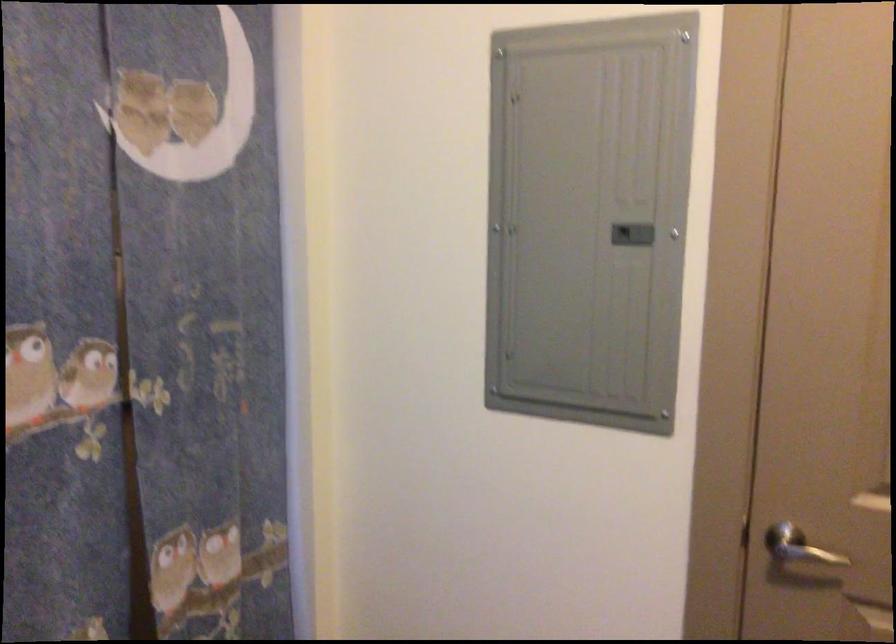
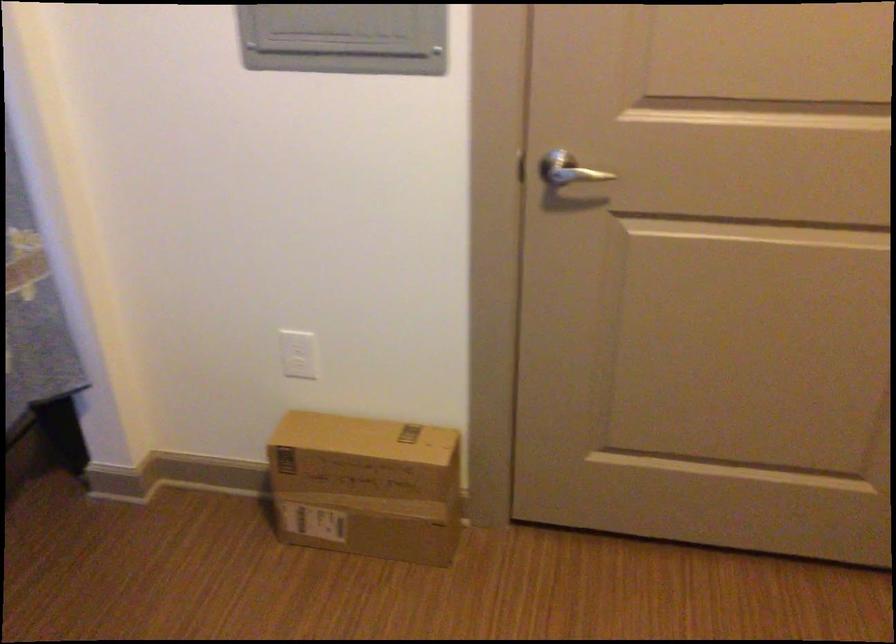
What movement of the cameraman would produce the second image?

The movement direction of the cameraman is right, forward.